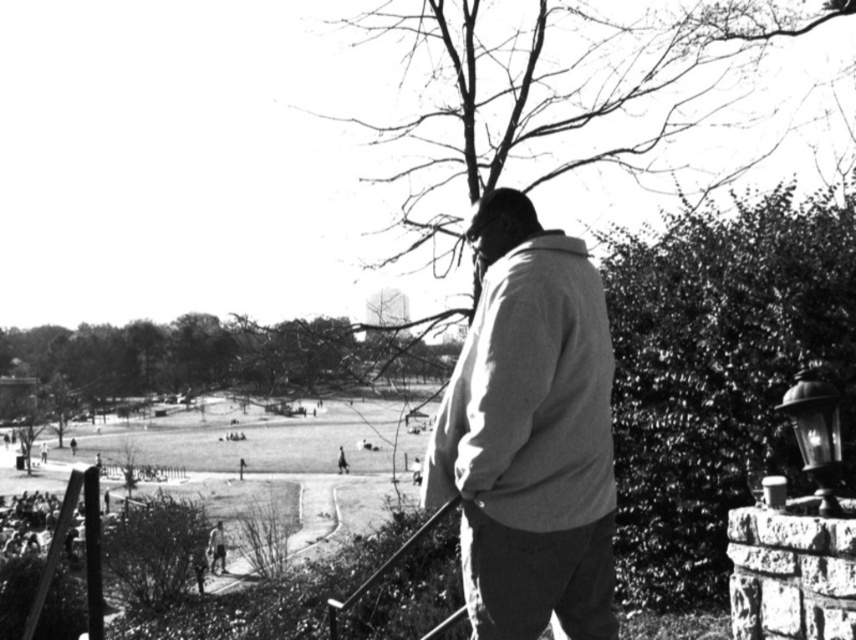
You are a photographer trying to capture a clear shot of the light gray cotton jacket at center and the smooth metal rail at lower center. Since you want both objects in focus, which one should you adjust your camera focus on first to ensure the jacket is sharp?

The light gray cotton jacket at center is closer to the viewer than the smooth metal rail at lower center. To ensure both are in focus, you should focus on the smooth metal rail at lower center first, as it is farther away, allowing the jacket to remain in focus as well.

You are a photographer trying to capture a candid shot of the person at the park. The smooth metal rail at lower center and the smooth beige jacket at lower center are both in your viewfinder. Which object should you focus on if you want to ensure the larger one is in sharp focus?

The smooth metal rail at lower center is larger in size than the smooth beige jacket at lower center, so you should focus on the smooth metal rail at lower center to ensure the larger object is in sharp focus.

You are standing in the park and see the person at the center wearing a light gray cotton jacket. If you walk straight ahead from your current position, will you pass by the point at coordinates [530,435] before reaching the person?

The point at coordinates [530,435] corresponds to the light gray cotton jacket at center, so walking straight ahead would mean you are already at the location of the person wearing the light gray cotton jacket at center. Therefore, you would not pass by the point before reaching them.